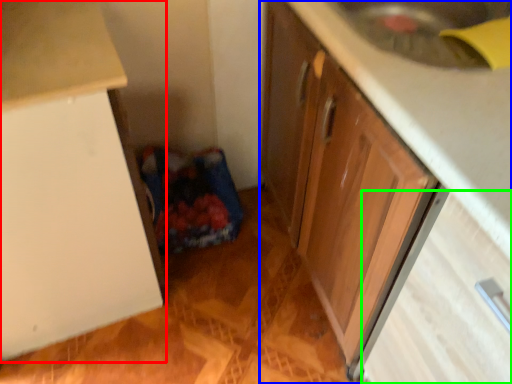
Question: Estimate the real-world distances between objects in this image. Which object is farther from cabinetry (highlighted by a red box), cabinetry (highlighted by a blue box) or drawer (highlighted by a green box)?

Choices:
 (A) cabinetry
 (B) drawer

Answer: (B)